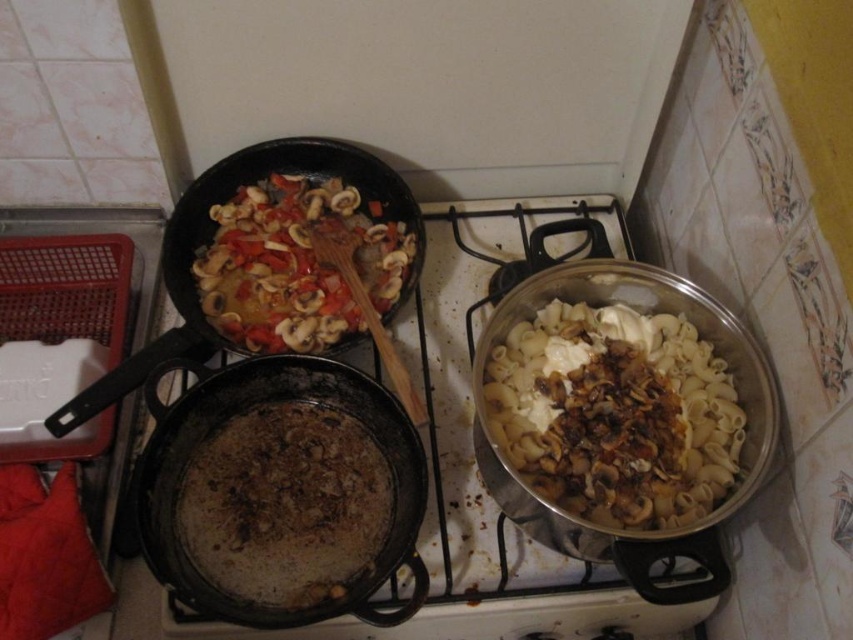
In the scene shown: You have a 30 cm wide lid that you want to place over the black cast iron wok at center and the slightly browned wooden spoon at upper left. Which object can the lid fit over without touching the edges?

The black cast iron wok at center is wider than the slightly browned wooden spoon at upper left, so the lid can fit over the black cast iron wok at center without touching the edges.

You are a chef preparing a dish and need to decide which container to use for a sauce that requires a deeper vessel. Based on the kitchen scene described, which object between the black cast iron wok at center and the white glossy pasta at center right would be more suitable?

The black cast iron wok at center is much taller than the white glossy pasta at center right, making it the better choice for a deeper vessel needed for the sauce.

In the scene shown: You are a chef preparing a meal and need to choose between the black cast iron wok at center and the shiny black wok at upper left. Which wok should you select if you need a larger one for cooking a stir fry?

The shiny black wok at upper left is larger than the black cast iron wok at center, so you should choose the shiny black wok at upper left for cooking a stir fry.